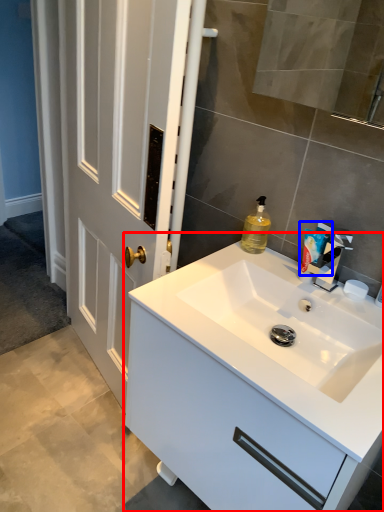
Question: Which of the following is the closest to the observer, bathroom cabinet (highlighted by a red box) or toiletry (highlighted by a blue box)?

Choices:
 (A) bathroom cabinet
 (B) toiletry

Answer: (A)